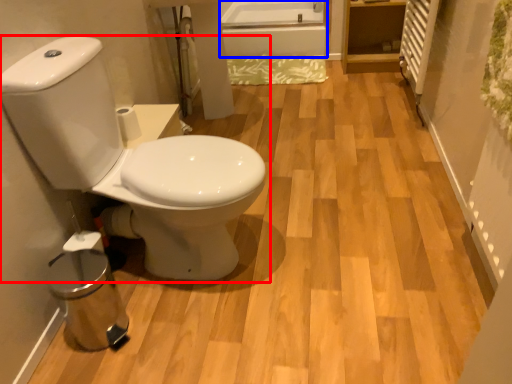
Question: Which point is closer to the camera, toilet (highlighted by a red box) or bath (highlighted by a blue box)?

Choices:
 (A) toilet
 (B) bath

Answer: (A)